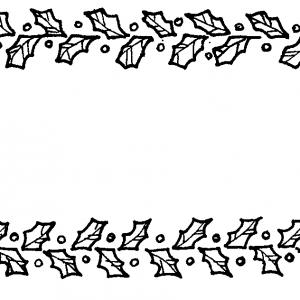
Where is `upper panel`? The height and width of the screenshot is (300, 300). upper panel is located at coordinates (74, 1).